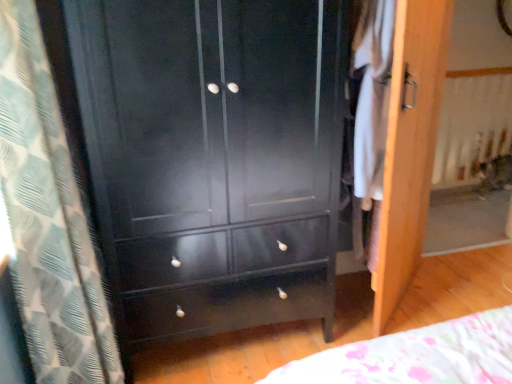
Question: From a real-world perspective, relative to white fabric at right, is matte black cabinet at center vertically above or below?

Choices:
 (A) above
 (B) below

Answer: (B)

Question: Based on their positions, is matte black cabinet at center located to the left or right of white fabric at right?

Choices:
 (A) right
 (B) left

Answer: (B)

Question: Considering the real-world distances, which object is farthest from the white fabric at right?

Choices:
 (A) white textured curtain at left
 (B) wooden screen door at right
 (C) matte black cabinet at center

Answer: (A)

Question: Based on their relative distances, which object is farther from the wooden screen door at right?

Choices:
 (A) white fabric at right
 (B) matte black cabinet at center
 (C) white textured curtain at left

Answer: (C)